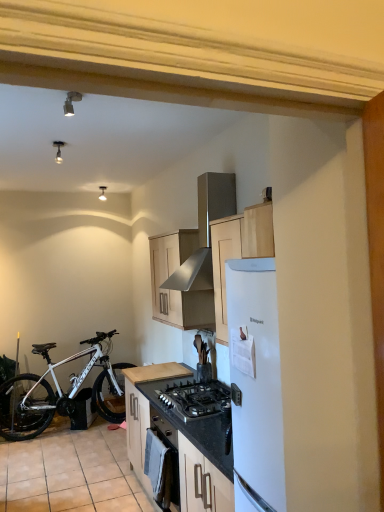
You are a GUI agent. You are given a task and a screenshot of the screen. Output one action in this format:
    pyautogui.click(x=<x>, y=<y>)
    Task: Click on the empty space that is ontop of beige tile at lower left
    
    Given the screenshot: What is the action you would take?
    pyautogui.click(x=57, y=454)